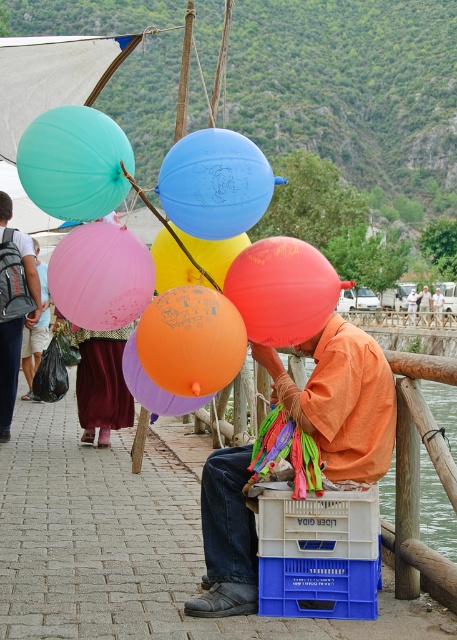
Between orange matte balloon at center and purple rubber balloon at center, which one appears on the left side from the viewer's perspective?

Positioned to the left is purple rubber balloon at center.

Can you confirm if orange matte balloon at center is wider than purple rubber balloon at center?

Indeed, orange matte balloon at center has a greater width compared to purple rubber balloon at center.

This screenshot has width=457, height=640. What do you see at coordinates (191, 340) in the screenshot? I see `orange matte balloon at center` at bounding box center [191, 340].

This screenshot has width=457, height=640. Find the location of `orange matte balloon at center`. orange matte balloon at center is located at coordinates (191, 340).

Is blue rubber balloon at center further to camera compared to pink rubber balloon at center?

No, blue rubber balloon at center is closer to the viewer.

How much distance is there between blue rubber balloon at center and pink rubber balloon at center?

The distance of blue rubber balloon at center from pink rubber balloon at center is 1.18 meters.

Where is `blue rubber balloon at center`? blue rubber balloon at center is located at coordinates (214, 182).

Which of these two, rubber balloon at center or pink rubber balloon at center, stands taller?

With more height is rubber balloon at center.

From the picture: Is rubber balloon at center to the right of pink rubber balloon at center from the viewer's perspective?

Indeed, rubber balloon at center is positioned on the right side of pink rubber balloon at center.

The height and width of the screenshot is (640, 457). I want to click on rubber balloon at center, so click(x=281, y=291).

Image resolution: width=457 pixels, height=640 pixels. I want to click on rubber balloon at center, so click(281, 291).